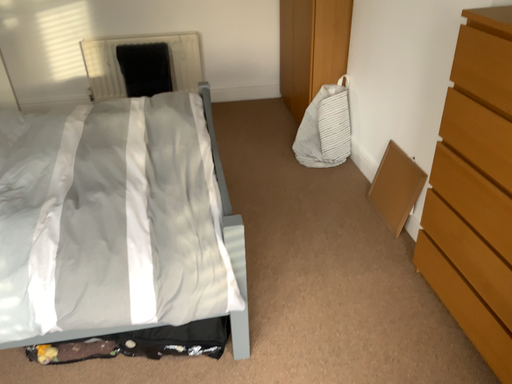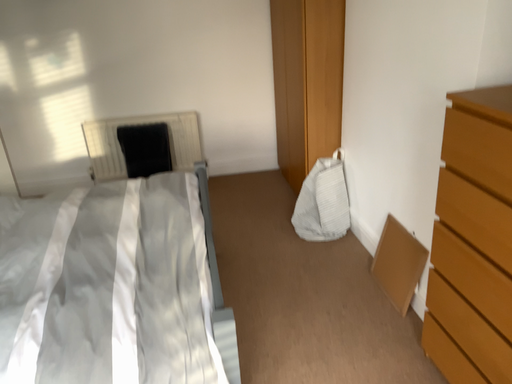
Question: Which way did the camera rotate in the video?

Choices:
 (A) rotated downward
 (B) rotated upward

Answer: (B)